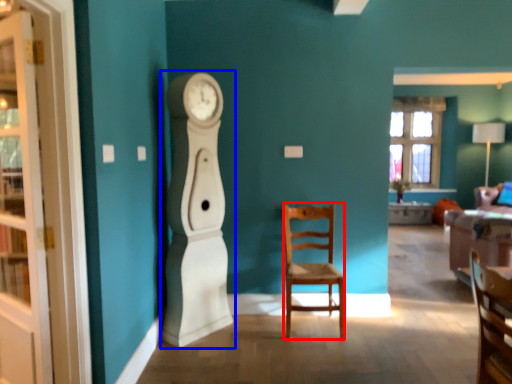
Question: Which of the following is the farthest to the observer, chair (highlighted by a red box) or clock (highlighted by a blue box)?

Choices:
 (A) chair
 (B) clock

Answer: (A)